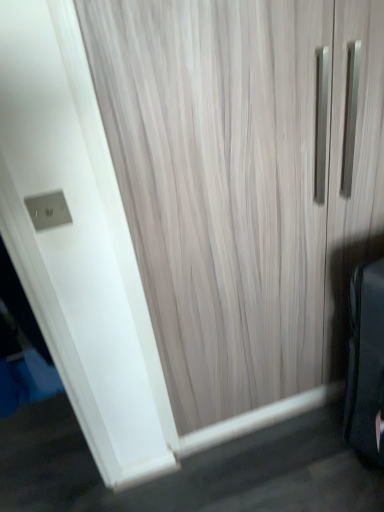
At what (x,y) coordinates should I click in order to perform the action: click on satin silver outlet at upper left. Please return your answer as a coordinate pair (x, y). The image size is (384, 512). Looking at the image, I should click on (48, 210).

Describe the element at coordinates (48, 210) in the screenshot. I see `satin silver outlet at upper left` at that location.

Find the location of a particular element. wooden door at center is located at coordinates (244, 183).

What do you see at coordinates (244, 183) in the screenshot? I see `wooden door at center` at bounding box center [244, 183].

The width and height of the screenshot is (384, 512). Identify the location of satin silver outlet at upper left. (48, 210).

Is wooden door at center to the left of satin silver outlet at upper left from the viewer's perspective?

No.

In the scene shown: Is wooden door at center closer to camera compared to satin silver outlet at upper left?

Yes, wooden door at center is closer to the camera.

Is point (301, 234) less distant than point (57, 223)?

No, (301, 234) is further to viewer.

From the image's perspective, is wooden door at center above or below satin silver outlet at upper left?

Clearly, from the image's perspective, wooden door at center is below satin silver outlet at upper left.

From a real-world perspective, which is physically above, wooden door at center or satin silver outlet at upper left?

From a 3D spatial view, satin silver outlet at upper left is above.

Considering the relative sizes of wooden door at center and satin silver outlet at upper left in the image provided, is wooden door at center thinner than satin silver outlet at upper left?

Incorrect, the width of wooden door at center is not less than that of satin silver outlet at upper left.

Which of these two, wooden door at center or satin silver outlet at upper left, stands taller?

wooden door at center is taller.

Based on their sizes in the image, would you say wooden door at center is bigger or smaller than satin silver outlet at upper left?

In the image, wooden door at center appears to be larger than satin silver outlet at upper left.

Is satin silver outlet at upper left a part of wooden door at center?

That's incorrect, satin silver outlet at upper left is not inside wooden door at center.

Is wooden door at center far away from satin silver outlet at upper left?

No, there isn't a large distance between wooden door at center and satin silver outlet at upper left.

Is wooden door at center facing away from satin silver outlet at upper left?

wooden door at center does not have its back to satin silver outlet at upper left.

How many degrees apart are the facing directions of wooden door at center and satin silver outlet at upper left?

The angle between the facing direction of wooden door at center and the facing direction of satin silver outlet at upper left is 0.884 degrees.

This screenshot has width=384, height=512. I want to click on door below the satin silver outlet at upper left (from the image's perspective), so pos(244,183).

Between satin silver outlet at upper left and wooden door at center, which one appears on the left side from the viewer's perspective?

Positioned to the left is satin silver outlet at upper left.

Is satin silver outlet at upper left positioned in front of wooden door at center?

No, it is not.

Is point (56, 193) positioned in front of point (324, 205)?

Yes.

From the image's perspective, is satin silver outlet at upper left below wooden door at center?

No, from the image's perspective, satin silver outlet at upper left is not beneath wooden door at center.

In the scene shown: From a real-world perspective, is satin silver outlet at upper left on top of wooden door at center?

Indeed, from a real-world perspective, satin silver outlet at upper left stands above wooden door at center.

Does satin silver outlet at upper left have a lesser width compared to wooden door at center?

Yes.

Considering the sizes of satin silver outlet at upper left and wooden door at center in the image, is satin silver outlet at upper left taller or shorter than wooden door at center?

Considering their sizes, satin silver outlet at upper left has less height than wooden door at center.

Consider the image. Who is bigger, satin silver outlet at upper left or wooden door at center?

wooden door at center is bigger.

Would you say wooden door at center is part of satin silver outlet at upper left's contents?

No, satin silver outlet at upper left does not contain wooden door at center.

Is satin silver outlet at upper left directly adjacent to wooden door at center?

satin silver outlet at upper left and wooden door at center are not in contact.

Is satin silver outlet at upper left facing away from wooden door at center?

No, wooden door at center is not at the back of satin silver outlet at upper left.

Where is `door that is on the right side of satin silver outlet at upper left`? The height and width of the screenshot is (512, 384). door that is on the right side of satin silver outlet at upper left is located at coordinates (244, 183).

I want to click on door in front of the satin silver outlet at upper left, so click(244, 183).

Find the location of a particular element. The image size is (384, 512). electric outlet that appears above the wooden door at center (from a real-world perspective) is located at coordinates (48, 210).